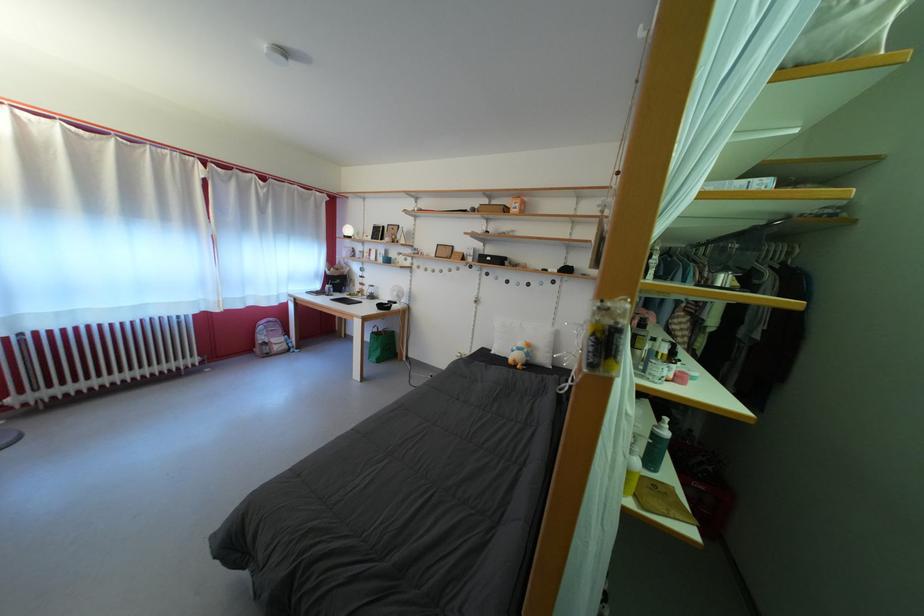
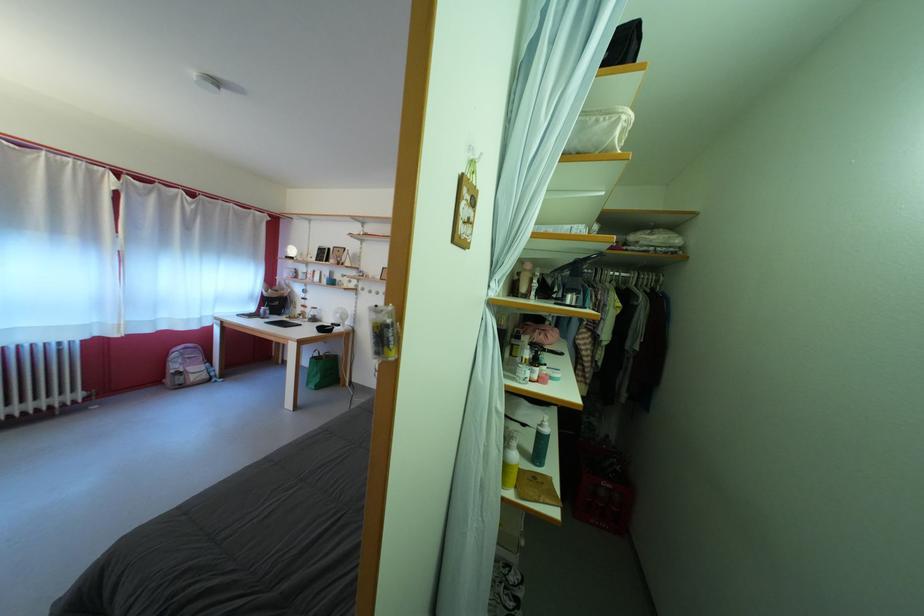
Where in the second image is the point corresponding to point 605,345 from the first image?

(383, 339)